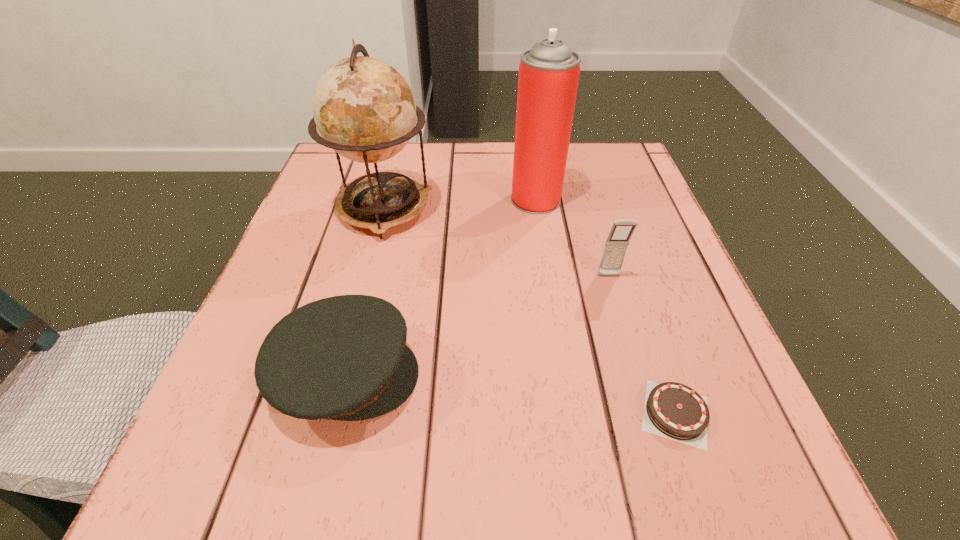
Locate an element on the screen. object at the near left corner is located at coordinates (345, 358).

Locate an element on the screen. This screenshot has width=960, height=540. object that is at the near right corner is located at coordinates (672, 410).

You are a GUI agent. You are given a task and a screenshot of the screen. Output one action in this format:
    pyautogui.click(x=<x>, y=<y>)
    Task: Click on the vacant space at the far edge of the desktop
    The image size is (960, 540).
    Given the screenshot: What is the action you would take?
    pyautogui.click(x=509, y=150)

At what (x,y) coordinates should I click in order to perform the action: click on free space at the left edge. Please return your answer as a coordinate pair (x, y). This screenshot has width=960, height=540. Looking at the image, I should click on (333, 268).

I want to click on vacant space at the right edge, so click(x=608, y=205).

At what (x,y) coordinates should I click in order to perform the action: click on free region at the far left corner. Please return your answer as a coordinate pair (x, y). The image size is (960, 540). Looking at the image, I should click on (340, 162).

The width and height of the screenshot is (960, 540). I want to click on free space at the far right corner, so click(x=576, y=171).

The height and width of the screenshot is (540, 960). Find the location of `empty space between the globe and the third nearest object`. empty space between the globe and the third nearest object is located at coordinates (496, 243).

Where is `vacant space that is in between the beret and the third shortest object`? vacant space that is in between the beret and the third shortest object is located at coordinates (478, 326).

The image size is (960, 540). In order to click on free space between the globe and the shortest object in this screenshot , I will do `click(529, 312)`.